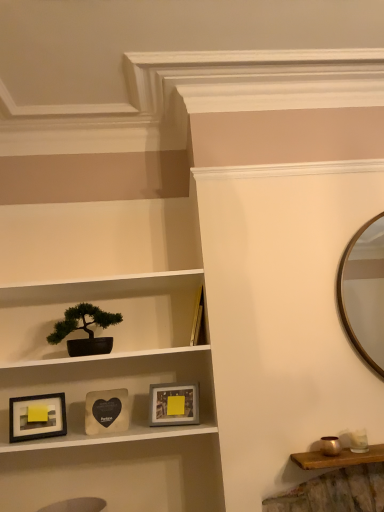
Identify the location of matte gray frame at center, marked as the 3th picture frame in a left-to-right arrangement. This screenshot has width=384, height=512. (173, 404).

In order to face green matte bonsai tree at left, should I rotate leftwards or rightwards?

→ It's best to rotate left around 13.735 degrees.

Find the location of `matte black pot at center`. matte black pot at center is located at coordinates (107, 388).

You are a GUI agent. You are given a task and a screenshot of the screen. Output one action in this format:
    pyautogui.click(x=<x>, y=<y>)
    Task: Click on the houseplant located above the matte black pot at center (from the image's perspective)
    This screenshot has width=384, height=512.
    Given the screenshot: What is the action you would take?
    pyautogui.click(x=85, y=330)

Between point (1, 382) and point (66, 311), which one is positioned in front?

The point (1, 382) is closer to the camera.

Based on their positions, is matte black pot at center located to the left or right of green matte bonsai tree at left?

Based on their positions, matte black pot at center is located to the right of green matte bonsai tree at left.

Does matte black picture frame at lower left, arranged as the 3th picture frame when viewed from the right, appear on the right side of wooden heart-shaped picture frame at center, the second picture frame from the left?

In fact, matte black picture frame at lower left, arranged as the 3th picture frame when viewed from the right, is to the left of wooden heart-shaped picture frame at center, the second picture frame from the left.

Considering the sizes of objects matte black picture frame at lower left, positioned as the 1th picture frame in left-to-right order, and wooden heart-shaped picture frame at center, the second picture frame from the left, in the image provided, who is bigger, matte black picture frame at lower left, positioned as the 1th picture frame in left-to-right order, or wooden heart-shaped picture frame at center, the second picture frame from the left,?

Bigger between the two is wooden heart-shaped picture frame at center, the second picture frame from the left.

I want to click on picture frame above the matte black picture frame at lower left, arranged as the 3th picture frame when viewed from the right (from a real-world perspective), so click(106, 411).

Is the surface of matte black picture frame at lower left, arranged as the 3th picture frame when viewed from the right, in direct contact with wooden heart-shaped picture frame at center, placed as the 2th picture frame when sorted from right to left?

No, matte black picture frame at lower left, arranged as the 3th picture frame when viewed from the right, is not next to wooden heart-shaped picture frame at center, placed as the 2th picture frame when sorted from right to left.

Is matte gray frame at center, which ranks as the first picture frame in right-to-left order, positioned beyond the bounds of matte black pot at center?

No, most part of matte gray frame at center, which ranks as the first picture frame in right-to-left order, lies within matte black pot at center.

Which of these two, matte gray frame at center, which ranks as the first picture frame in right-to-left order, or matte black pot at center, is wider?

matte black pot at center is wider.

Is matte gray frame at center, which ranks as the first picture frame in right-to-left order, behind matte black pot at center?

Yes, matte gray frame at center, which ranks as the first picture frame in right-to-left order, is further from the camera.

Is matte gray frame at center, marked as the 3th picture frame in a left-to-right arrangement, far from matte black pot at center?

matte gray frame at center, marked as the 3th picture frame in a left-to-right arrangement, is near matte black pot at center, not far away.

How many degrees apart are the facing directions of matte gray frame at center, which ranks as the first picture frame in right-to-left order, and green matte bonsai tree at left?

The angular difference between matte gray frame at center, which ranks as the first picture frame in right-to-left order, and green matte bonsai tree at left is 18.9 degrees.

Is matte gray frame at center, which ranks as the first picture frame in right-to-left order, next to green matte bonsai tree at left?

No, matte gray frame at center, which ranks as the first picture frame in right-to-left order, is not making contact with green matte bonsai tree at left.

Which object is further away from the camera taking this photo, matte gray frame at center, which ranks as the first picture frame in right-to-left order, or green matte bonsai tree at left?

matte gray frame at center, which ranks as the first picture frame in right-to-left order.

Which picture frame is the 2nd one when counting from the back of the green matte bonsai tree at left? Please provide its 2D coordinates.

[(173, 404)]

Based on the photo, based on their positions, is green matte bonsai tree at left located to the left or right of matte gray frame at center, which ranks as the first picture frame in right-to-left order?

From the image, it's evident that green matte bonsai tree at left is to the left of matte gray frame at center, which ranks as the first picture frame in right-to-left order.

You are a GUI agent. You are given a task and a screenshot of the screen. Output one action in this format:
    pyautogui.click(x=<x>, y=<y>)
    Task: Click on the picture frame that is the 2nd object to the right of the green matte bonsai tree at left, starting at the anchor
    This screenshot has height=512, width=384.
    Given the screenshot: What is the action you would take?
    (x=173, y=404)

Considering their positions, is green matte bonsai tree at left located in front of or behind matte gray frame at center, which ranks as the first picture frame in right-to-left order?

green matte bonsai tree at left is in front of matte gray frame at center, which ranks as the first picture frame in right-to-left order.

Is green matte bonsai tree at left inside the boundaries of matte gray frame at center, which ranks as the first picture frame in right-to-left order, or outside?

The correct answer is: outside.

At what (x,y) coordinates should I click in order to perform the action: click on shelf above the matte black picture frame at lower left, positioned as the 1th picture frame in left-to-right order (from a real-world perspective). Please return your answer as a coordinate pair (x, y). Looking at the image, I should click on (107, 388).

Is there a large distance between matte black picture frame at lower left, arranged as the 3th picture frame when viewed from the right, and matte black pot at center?

matte black picture frame at lower left, arranged as the 3th picture frame when viewed from the right, is near matte black pot at center, not far away.

Is matte black picture frame at lower left, positioned as the 1th picture frame in left-to-right order, inside the boundaries of matte black pot at center, or outside?

matte black picture frame at lower left, positioned as the 1th picture frame in left-to-right order, can be found inside matte black pot at center.

Which of these two, matte black picture frame at lower left, arranged as the 3th picture frame when viewed from the right, or matte black pot at center, is wider?

matte black pot at center is wider.

Would you say matte black picture frame at lower left, arranged as the 3th picture frame when viewed from the right, is part of matte gray frame at center, which ranks as the first picture frame in right-to-left order,'s contents?

No.

Is matte gray frame at center, which ranks as the first picture frame in right-to-left order, shorter than matte black picture frame at lower left, arranged as the 3th picture frame when viewed from the right?

Yes.

Is matte gray frame at center, which ranks as the first picture frame in right-to-left order, looking in the opposite direction of matte black picture frame at lower left, positioned as the 1th picture frame in left-to-right order?

That's not correct — matte gray frame at center, which ranks as the first picture frame in right-to-left order, is not looking away from matte black picture frame at lower left, positioned as the 1th picture frame in left-to-right order.

Can you confirm if matte gray frame at center, which ranks as the first picture frame in right-to-left order, is thinner than matte black picture frame at lower left, arranged as the 3th picture frame when viewed from the right?

Incorrect, the width of matte gray frame at center, which ranks as the first picture frame in right-to-left order, is not less than that of matte black picture frame at lower left, arranged as the 3th picture frame when viewed from the right.

Locate an element on the screen. The width and height of the screenshot is (384, 512). houseplant that is on the left side of matte black pot at center is located at coordinates (85, 330).

Where is `the 1st picture frame behind the matte black picture frame at lower left, positioned as the 1th picture frame in left-to-right order, starting your count from the anchor`? This screenshot has width=384, height=512. the 1st picture frame behind the matte black picture frame at lower left, positioned as the 1th picture frame in left-to-right order, starting your count from the anchor is located at coordinates (106, 411).

Estimate the real-world distances between objects in this image. Which object is closer to matte black pot at center, matte black picture frame at lower left, arranged as the 3th picture frame when viewed from the right, or green matte bonsai tree at left?

green matte bonsai tree at left lies closer to matte black pot at center than the other object.

From the picture: When comparing their distances from wooden heart-shaped picture frame at center, the second picture frame from the left, does green matte bonsai tree at left or matte black pot at center seem closer?

The object closer to wooden heart-shaped picture frame at center, the second picture frame from the left, is matte black pot at center.

Considering their positions, is matte black picture frame at lower left, positioned as the 1th picture frame in left-to-right order, positioned closer to green matte bonsai tree at left than matte gray frame at center, marked as the 3th picture frame in a left-to-right arrangement?

matte black picture frame at lower left, positioned as the 1th picture frame in left-to-right order.

In the scene shown: From the image, which object appears to be farther from green matte bonsai tree at left, matte gray frame at center, marked as the 3th picture frame in a left-to-right arrangement, or matte black pot at center?

matte gray frame at center, marked as the 3th picture frame in a left-to-right arrangement, is positioned further to the anchor green matte bonsai tree at left.

When comparing their distances from matte black pot at center, does matte gray frame at center, which ranks as the first picture frame in right-to-left order, or wooden heart-shaped picture frame at center, placed as the 2th picture frame when sorted from right to left, seem closer?

wooden heart-shaped picture frame at center, placed as the 2th picture frame when sorted from right to left, is closer to matte black pot at center.

Looking at the image, which one is located closer to matte gray frame at center, marked as the 3th picture frame in a left-to-right arrangement, green matte bonsai tree at left or matte black picture frame at lower left, positioned as the 1th picture frame in left-to-right order?

green matte bonsai tree at left is closer to matte gray frame at center, marked as the 3th picture frame in a left-to-right arrangement.

Estimate the real-world distances between objects in this image. Which object is further from wooden heart-shaped picture frame at center, the second picture frame from the left, matte black pot at center or matte gray frame at center, marked as the 3th picture frame in a left-to-right arrangement?

Based on the image, matte black pot at center appears to be further to wooden heart-shaped picture frame at center, the second picture frame from the left.

When comparing their distances from matte black picture frame at lower left, arranged as the 3th picture frame when viewed from the right, does matte black pot at center or green matte bonsai tree at left seem closer?

Among the two, green matte bonsai tree at left is located nearer to matte black picture frame at lower left, arranged as the 3th picture frame when viewed from the right.

The width and height of the screenshot is (384, 512). In order to click on shelf between green matte bonsai tree at left and wooden heart-shaped picture frame at center, placed as the 2th picture frame when sorted from right to left, in the up-down direction in this screenshot , I will do (x=107, y=388).

You are a GUI agent. You are given a task and a screenshot of the screen. Output one action in this format:
    pyautogui.click(x=<x>, y=<y>)
    Task: Click on the shelf between matte black picture frame at lower left, arranged as the 3th picture frame when viewed from the right, and wooden heart-shaped picture frame at center, placed as the 2th picture frame when sorted from right to left, from left to right
    
    Given the screenshot: What is the action you would take?
    pyautogui.click(x=107, y=388)

At what (x,y) coordinates should I click in order to perform the action: click on picture frame between matte black pot at center and matte gray frame at center, marked as the 3th picture frame in a left-to-right arrangement, from left to right. Please return your answer as a coordinate pair (x, y). The height and width of the screenshot is (512, 384). Looking at the image, I should click on (106, 411).

Where is `houseplant situated between matte black picture frame at lower left, arranged as the 3th picture frame when viewed from the right, and matte gray frame at center, marked as the 3th picture frame in a left-to-right arrangement, from left to right`? The width and height of the screenshot is (384, 512). houseplant situated between matte black picture frame at lower left, arranged as the 3th picture frame when viewed from the right, and matte gray frame at center, marked as the 3th picture frame in a left-to-right arrangement, from left to right is located at coordinates tap(85, 330).